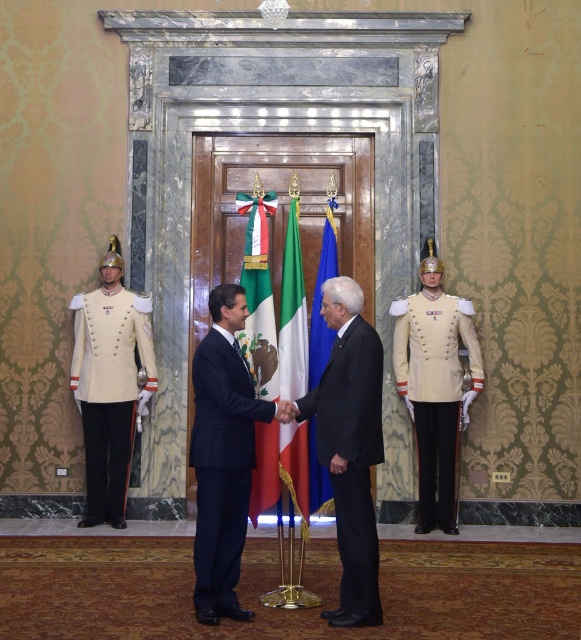
Question: Which object is the closest to the green fabric flag at center?

Choices:
 (A) light beige fabric uniform at right
 (B) cream matte uniform at left

Answer: (A)

Question: Is light beige fabric uniform at right smaller than green fabric flag at center?

Choices:
 (A) yes
 (B) no

Answer: (A)

Question: Does light beige fabric uniform at right have a smaller size compared to green and white striped flag at center?

Choices:
 (A) no
 (B) yes

Answer: (B)

Question: Does navy blue suit at center appear over blue fabric flag at center?

Choices:
 (A) yes
 (B) no

Answer: (B)

Question: Which point is closer to the camera?

Choices:
 (A) green fabric flag at center
 (B) black wool suit at center
 (C) navy blue suit at center
 (D) cream matte uniform at left

Answer: (B)

Question: Among these points, which one is nearest to the camera?

Choices:
 (A) (338, 419)
 (B) (235, 380)
 (C) (317, 310)

Answer: (A)